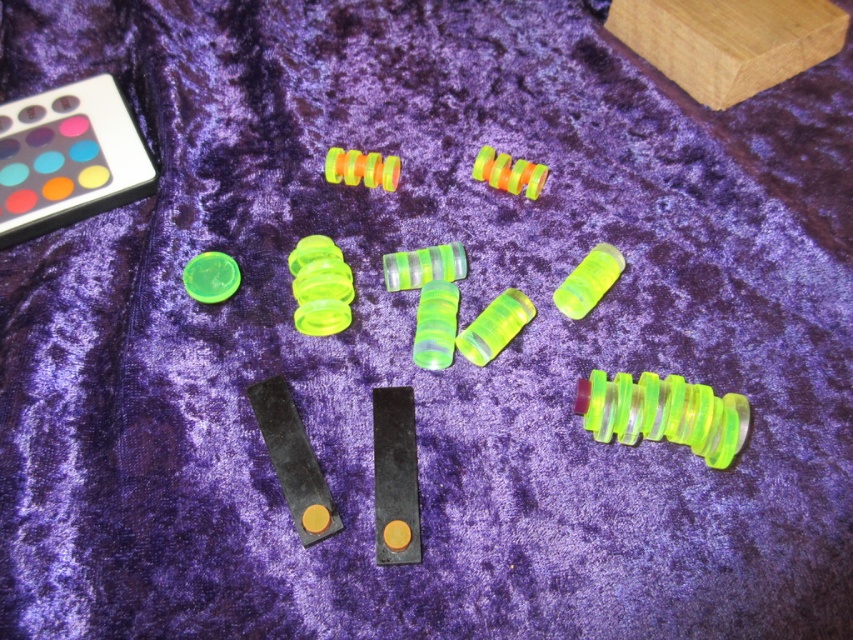
You are organizing the components on the purple fabric background. You need to place a new component exactly at point (589,280). What object is currently occupying that location?

The translucent neon green spring at center right is located at point (589,280).